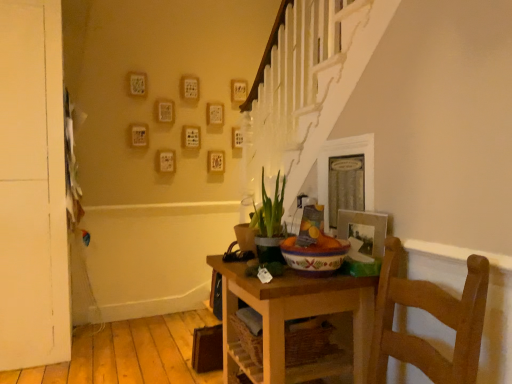
Question: Based on their positions, is green matte plant at center located to the left or right of metallic silver photo frame at upper right?

Choices:
 (A) left
 (B) right

Answer: (A)

Question: From the image's perspective, is green matte plant at center located above or below metallic silver photo frame at upper right?

Choices:
 (A) above
 (B) below

Answer: (A)

Question: Estimate the real-world distances between objects in this image. Which object is closer to the white matte door at left?

Choices:
 (A) wooden table at center
 (B) metallic silver photo frame at upper right
 (C) green matte plant at center

Answer: (C)

Question: Which is nearer to the green matte plant at center?

Choices:
 (A) white matte door at left
 (B) wooden table at center
 (C) metallic silver photo frame at upper right

Answer: (B)